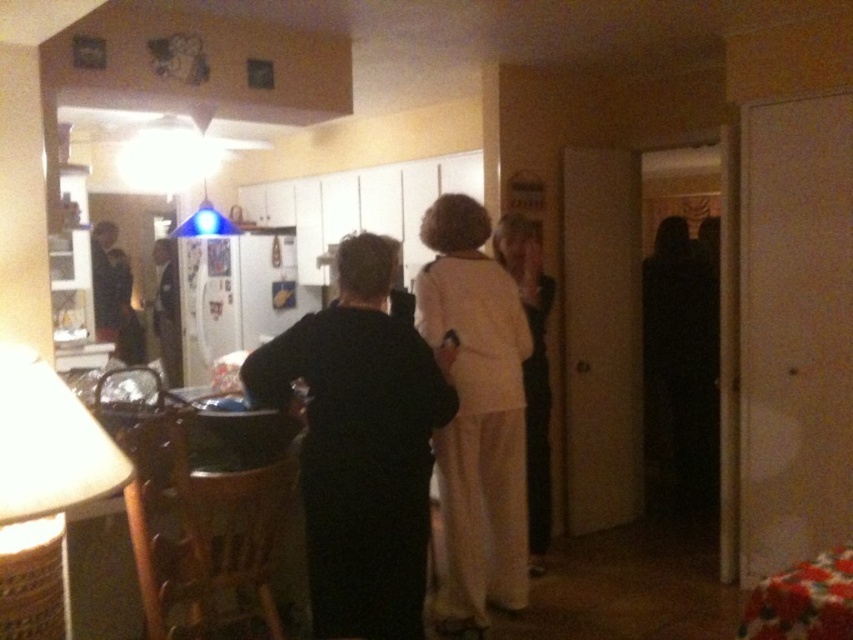
Is light beige fabric dress at center bigger than white fabric dress at center?

Yes, light beige fabric dress at center is bigger than white fabric dress at center.

Is light beige fabric dress at center to the right of white fabric dress at center from the viewer's perspective?

In fact, light beige fabric dress at center is to the left of white fabric dress at center.

Who is more forward, (x=466, y=202) or (x=544, y=368)?

Point (x=466, y=202) is in front.

At what (x,y) coordinates should I click in order to perform the action: click on light beige fabric dress at center. Please return your answer as a coordinate pair (x, y). Looking at the image, I should click on (476, 413).

Does black matte dress at center appear over white fabric dress at center?

Actually, black matte dress at center is below white fabric dress at center.

Is black matte dress at center to the right of white fabric dress at center from the viewer's perspective?

In fact, black matte dress at center is to the left of white fabric dress at center.

Where is `black matte dress at center`? This screenshot has height=640, width=853. black matte dress at center is located at coordinates (360, 445).

Image resolution: width=853 pixels, height=640 pixels. I want to click on black matte dress at center, so click(360, 445).

Between woven bamboo lampshade at lower left and white fabric dress at center, which one is positioned lower?

Positioned lower is woven bamboo lampshade at lower left.

Is point (38, 378) less distant than point (508, 259)?

Yes, it is in front of point (508, 259).

Between point (42, 472) and point (544, 320), which one is positioned in front?

Point (42, 472)

You are a GUI agent. You are given a task and a screenshot of the screen. Output one action in this format:
    pyautogui.click(x=<x>, y=<y>)
    Task: Click on the woven bamboo lampshade at lower left
    
    Given the screenshot: What is the action you would take?
    click(x=44, y=488)